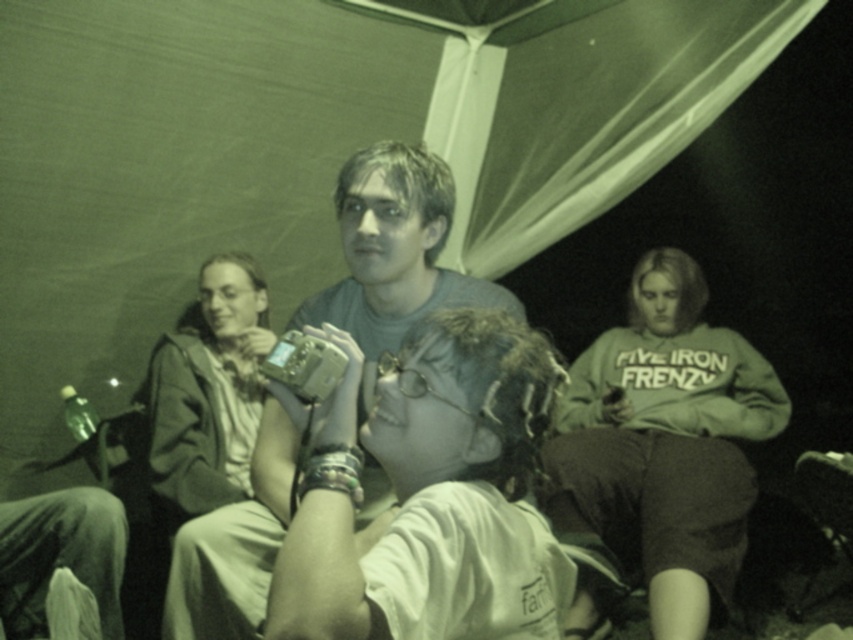
Is point (396, 465) positioned before point (675, 468)?

Yes, point (396, 465) is closer to viewer.

Consider the image. Can you confirm if matte silver camera at center is bigger than white cotton sweatshirt at right?

Actually, matte silver camera at center might be smaller than white cotton sweatshirt at right.

Locate an element on the screen. The height and width of the screenshot is (640, 853). matte silver camera at center is located at coordinates click(430, 493).

Can you confirm if white cotton sweatshirt at right is wider than light brown leather jacket at left?

Yes, white cotton sweatshirt at right is wider than light brown leather jacket at left.

From the picture: Is white cotton sweatshirt at right to the right of light brown leather jacket at left from the viewer's perspective?

Correct, you'll find white cotton sweatshirt at right to the right of light brown leather jacket at left.

Where is `white cotton sweatshirt at right`? The width and height of the screenshot is (853, 640). white cotton sweatshirt at right is located at coordinates (665, 442).

Does matte silver camera at center have a smaller size compared to matte gray camera at center?

Yes.

Which is behind, point (514, 522) or point (231, 556)?

Positioned behind is point (231, 556).

Which is behind, point (498, 332) or point (427, 154)?

Point (427, 154)

This screenshot has width=853, height=640. In order to click on matte silver camera at center in this screenshot , I will do `click(430, 493)`.